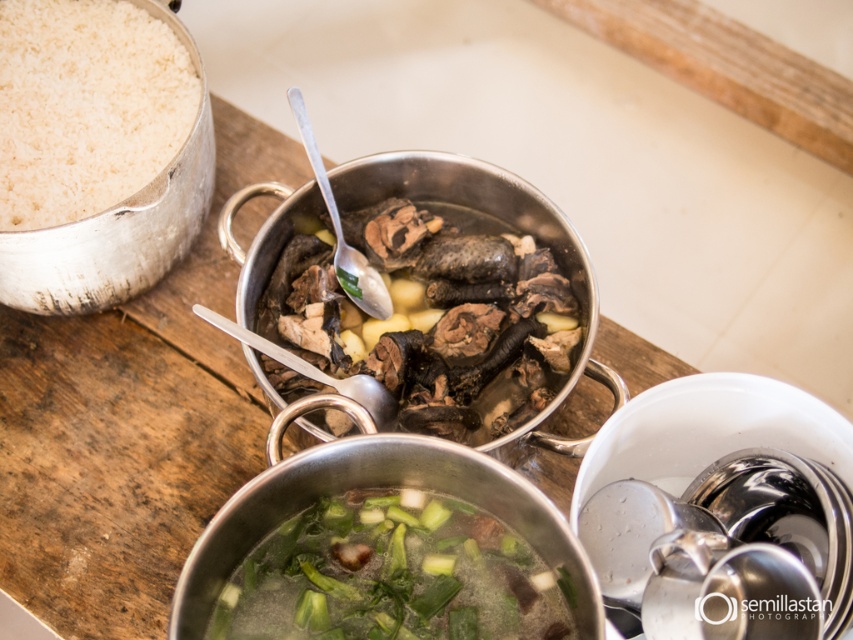
Is brown matte meat at center to the left of green leafy vegetables at center from the viewer's perspective?

No, brown matte meat at center is not to the left of green leafy vegetables at center.

Between brown matte meat at center and green leafy vegetables at center, which one appears on the left side from the viewer's perspective?

green leafy vegetables at center is more to the left.

Is point (399, 236) closer to viewer compared to point (398, 502)?

No.

Locate an element on the screen. brown matte meat at center is located at coordinates (434, 317).